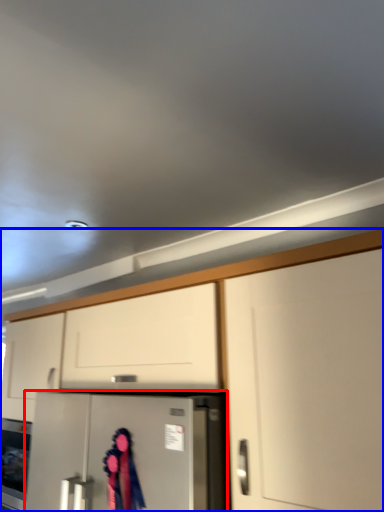
Question: Which point is closer to the camera, refrigerator (highlighted by a red box) or cabinetry (highlighted by a blue box)?

Choices:
 (A) refrigerator
 (B) cabinetry

Answer: (B)